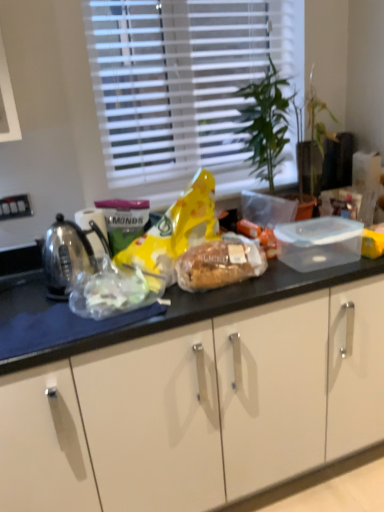
Question: Should I look upward or downward to see translucent plastic bread at center?

Choices:
 (A) down
 (B) up

Answer: (A)

Question: Is white blinds at upper center taller than translucent plastic bag at left?

Choices:
 (A) yes
 (B) no

Answer: (A)

Question: Would you say white blinds at upper center is outside translucent plastic bag at left?

Choices:
 (A) no
 (B) yes

Answer: (B)

Question: Is white blinds at upper center positioned far away from translucent plastic bag at left?

Choices:
 (A) yes
 (B) no

Answer: (B)

Question: Is white blinds at upper center next to translucent plastic bag at left and touching it?

Choices:
 (A) yes
 (B) no

Answer: (B)

Question: Is white blinds at upper center in front of translucent plastic bag at left?

Choices:
 (A) yes
 (B) no

Answer: (B)

Question: Can you confirm if white blinds at upper center is positioned to the left of translucent plastic bag at left?

Choices:
 (A) yes
 (B) no

Answer: (B)

Question: Is polished stainless steel kettle at left located outside white blinds at upper center?

Choices:
 (A) yes
 (B) no

Answer: (A)

Question: Is polished stainless steel kettle at left far away from white blinds at upper center?

Choices:
 (A) no
 (B) yes

Answer: (A)

Question: Would you say white blinds at upper center is part of polished stainless steel kettle at left's contents?

Choices:
 (A) no
 (B) yes

Answer: (A)

Question: Considering the relative positions of polished stainless steel kettle at left and white blinds at upper center in the image provided, is polished stainless steel kettle at left in front of white blinds at upper center?

Choices:
 (A) yes
 (B) no

Answer: (A)

Question: From a real-world perspective, is polished stainless steel kettle at left beneath white blinds at upper center?

Choices:
 (A) yes
 (B) no

Answer: (A)

Question: Does polished stainless steel kettle at left have a greater height compared to white blinds at upper center?

Choices:
 (A) yes
 (B) no

Answer: (B)

Question: From the image's perspective, is white blinds at upper center on polished stainless steel kettle at left?

Choices:
 (A) yes
 (B) no

Answer: (A)